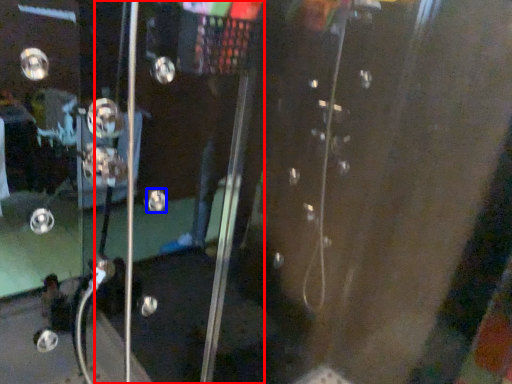
Question: Which object appears farthest to the camera in this image, screen door (highlighted by a red box) or knob (highlighted by a blue box)?

Choices:
 (A) screen door
 (B) knob

Answer: (B)